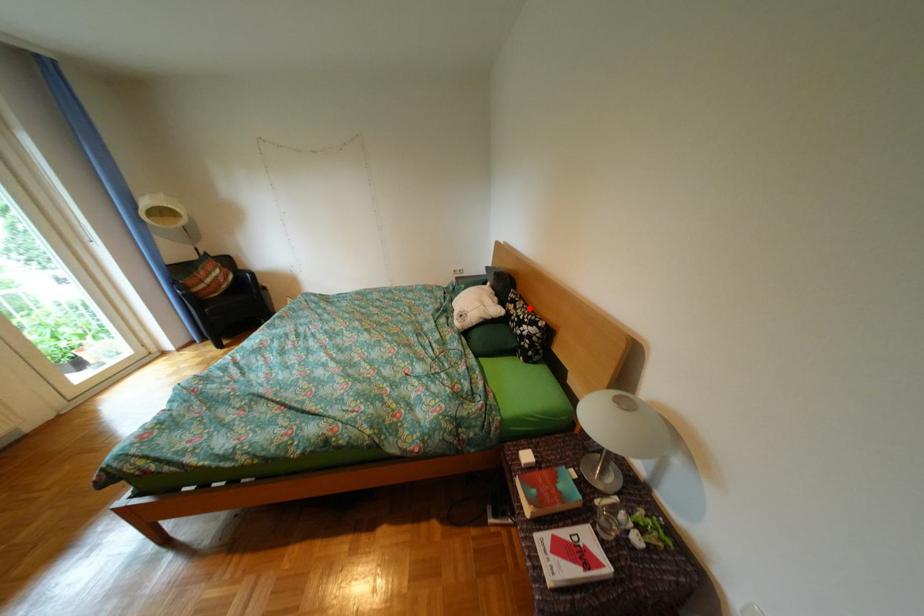
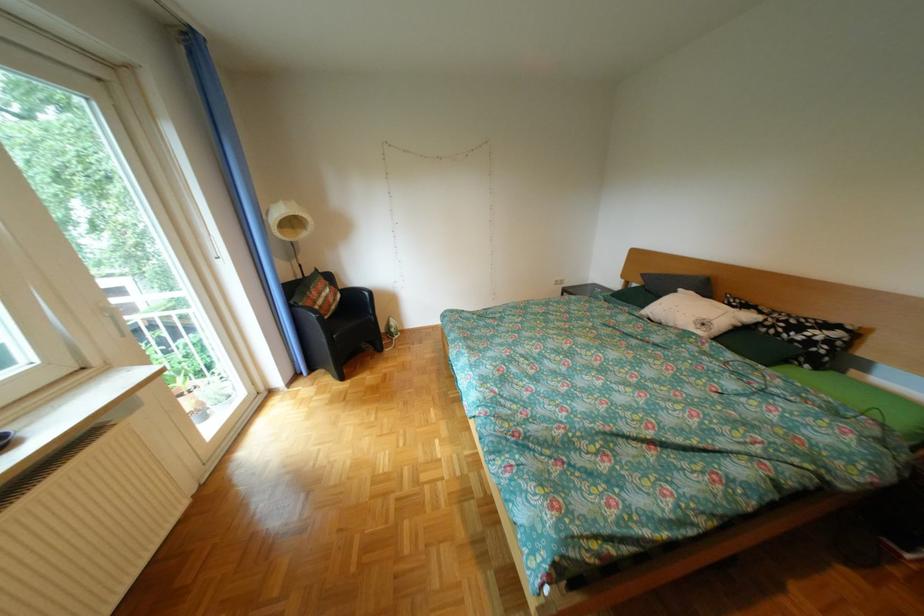
In the second image, find the point that corresponds to the highlighted location in the first image.

(775, 313)